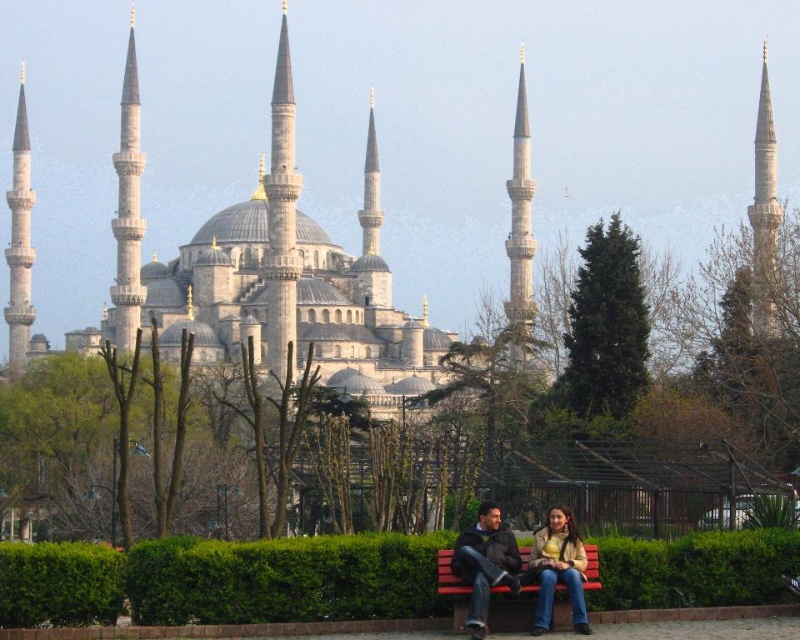
You are a photographer standing in the park near the Blue Mosque. You want to take a photo of the jeans at center and the dark brown leather jacket at lower center. How far apart are these two items in inches?

The jeans at center is 32.81 inches from dark brown leather jacket at lower center.